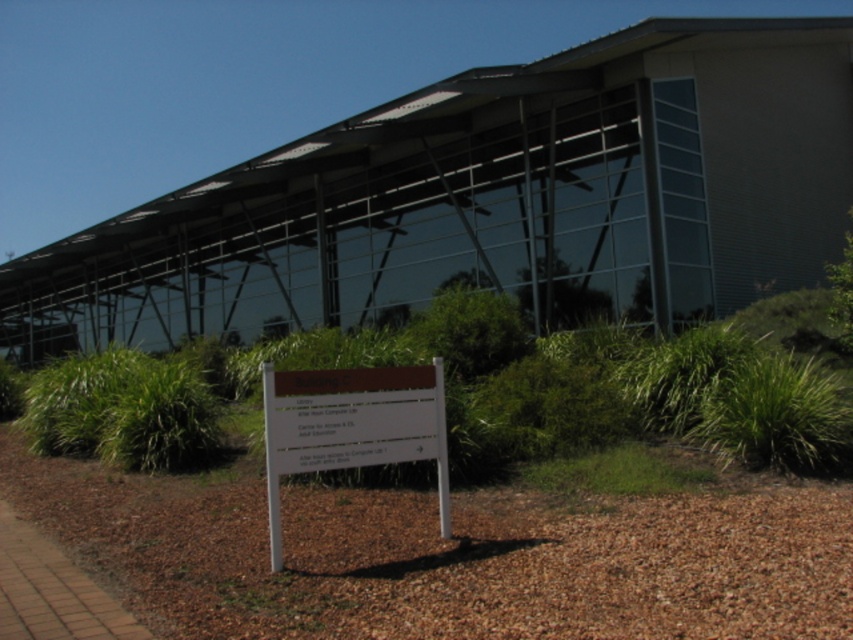
You are a landscape architect designing a new garden layout. You need to place a decorative statue that requires a 2x2 meter space. Given the brown matte sign at center and the green grass at lower center, which area would be suitable for placing the statue?

The brown matte sign at center is larger in size than the green grass at lower center, so the brown matte sign at center would be suitable for placing the decorative statue requiring a 2x2 meter space.

You are standing at the entrance of the building and want to place a 4 meter long banner between the brown matte sign at center and the green grass at lower right. Can the banner fit without overlapping either object?

The distance between the brown matte sign at center and the green grass at lower right is 3.92 meters. Since the banner is 4 meters long, it would be 0.08 meters too long and would overlap one of the objects.